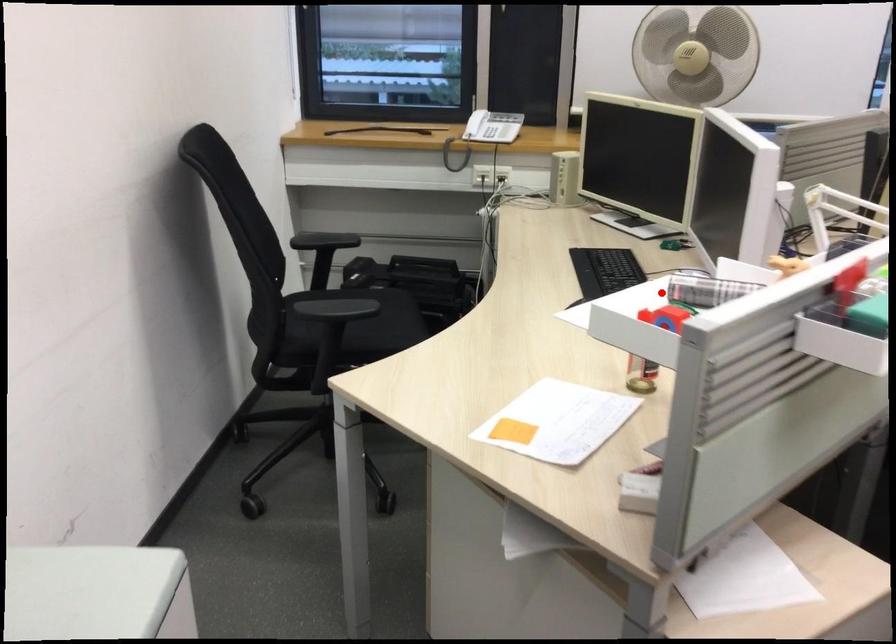
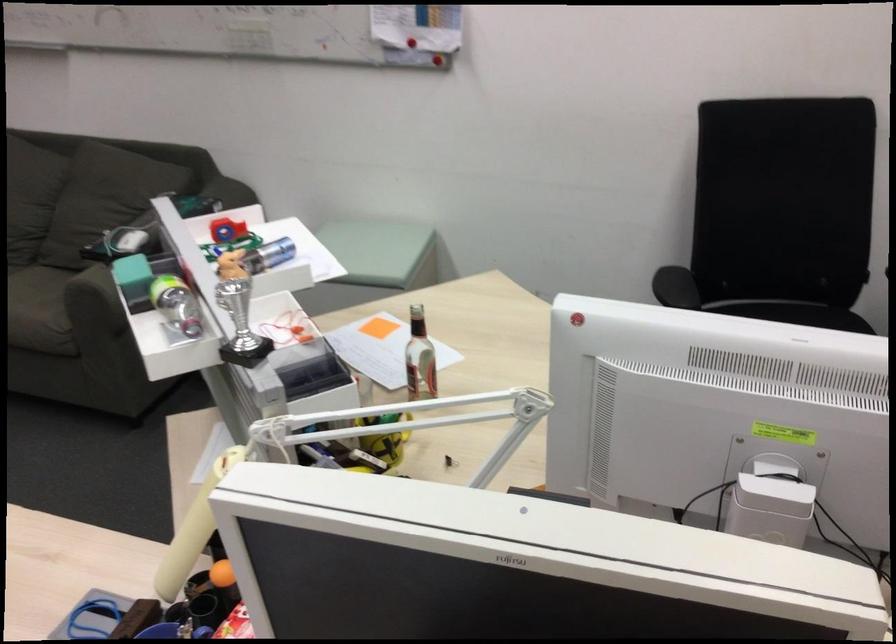
Question: I am providing you with two images of the same scene from different viewpoints. Given a red point in image1, look at the same physical point in image2. Is it:

Choices:
 (A) Closer to the viewpoint
 (B) Farther from the viewpoint

Answer: (B)